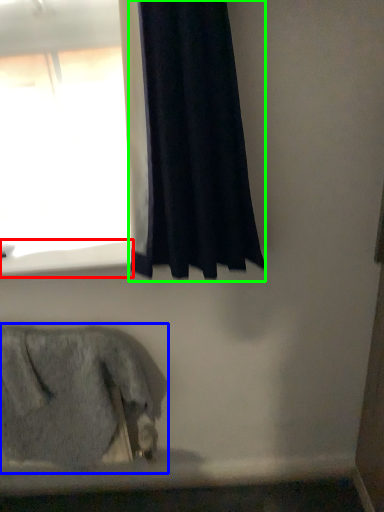
Question: Which is farther away from window sill (highlighted by a red box)? animal (highlighted by a blue box) or curtain (highlighted by a green box)?

Choices:
 (A) animal
 (B) curtain

Answer: (A)